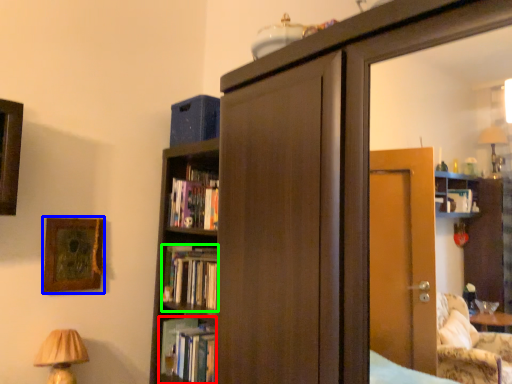
Question: Which object is positioned closest to book (highlighted by a red box)? Select from picture frame (highlighted by a blue box) and book (highlighted by a green box).

Choices:
 (A) picture frame
 (B) book

Answer: (B)